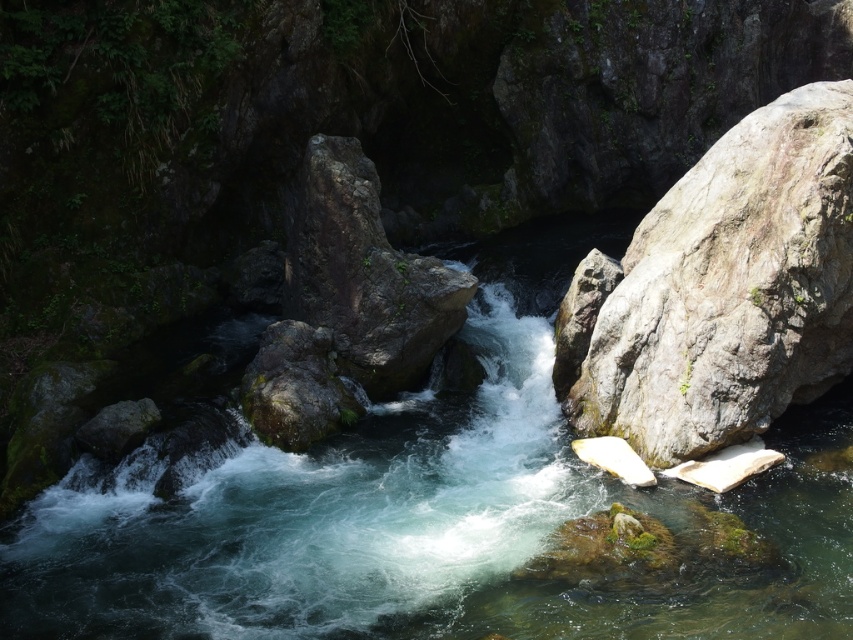
Question: Which object appears closest to the camera in this image?

Choices:
 (A) gray rough rock at right
 (B) clear water at center

Answer: (B)

Question: Does clear water at center lie behind gray rough rock at right?

Choices:
 (A) no
 (B) yes

Answer: (A)

Question: Does clear water at center have a smaller size compared to gray rough rock at right?

Choices:
 (A) yes
 (B) no

Answer: (B)

Question: Which of the following is the farthest from the observer?

Choices:
 (A) (706, 227)
 (B) (231, 467)

Answer: (B)

Question: Is clear water at center thinner than gray rough rock at right?

Choices:
 (A) yes
 (B) no

Answer: (B)

Question: Which point is farther to the camera?

Choices:
 (A) (497, 556)
 (B) (692, 305)

Answer: (B)